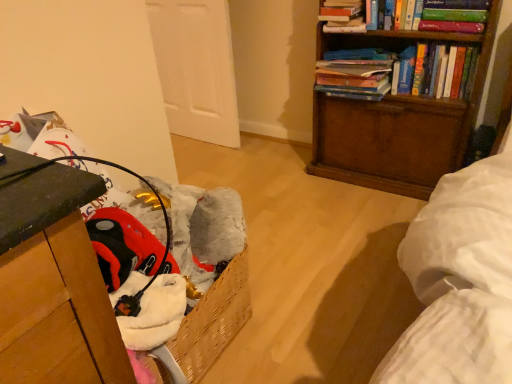
Question: Considering the relative sizes of wooden bookcase at upper right and hardcover books at upper right, which ranks as the second book in left-to-right order, in the image provided, is wooden bookcase at upper right taller than hardcover books at upper right, which ranks as the second book in left-to-right order,?

Choices:
 (A) yes
 (B) no

Answer: (A)

Question: Can you confirm if wooden bookcase at upper right is smaller than hardcover books at upper right, the 2th book from the right?

Choices:
 (A) yes
 (B) no

Answer: (B)

Question: Is hardcover books at upper right, which ranks as the second book in left-to-right order, located within wooden bookcase at upper right?

Choices:
 (A) no
 (B) yes

Answer: (B)

Question: Is the depth of wooden bookcase at upper right greater than that of hardcover books at upper right, which ranks as the second book in left-to-right order?

Choices:
 (A) no
 (B) yes

Answer: (A)

Question: Does wooden bookcase at upper right appear on the left side of hardcover books at upper right, the 2th book from the right?

Choices:
 (A) no
 (B) yes

Answer: (A)

Question: In terms of height, does hardcover books at upper right, the third book from the left, look taller or shorter compared to hardcover book at upper right, the 3th book from the right?

Choices:
 (A) tall
 (B) short

Answer: (A)

Question: Looking at the image, does hardcover books at upper right, the third book from the left, seem bigger or smaller compared to hardcover book at upper right, which is the 1th book from left to right?

Choices:
 (A) small
 (B) big

Answer: (B)

Question: Is point (461, 59) positioned closer to the camera than point (352, 16)?

Choices:
 (A) farther
 (B) closer

Answer: (B)

Question: From a real-world perspective, is hardcover books at upper right, the 1th book when ordered from right to left, above or below hardcover book at upper right, the 3th book from the right?

Choices:
 (A) below
 (B) above

Answer: (A)

Question: Looking at their shapes, would you say hardcover books at upper right, the third book from the left, is wider or thinner than wooden bookcase at upper right?

Choices:
 (A) thin
 (B) wide

Answer: (A)

Question: Is hardcover books at upper right, the third book from the left, bigger or smaller than wooden bookcase at upper right?

Choices:
 (A) small
 (B) big

Answer: (A)

Question: Considering the relative positions of hardcover books at upper right, the 1th book when ordered from right to left, and wooden bookcase at upper right in the image provided, is hardcover books at upper right, the 1th book when ordered from right to left, to the left or to the right of wooden bookcase at upper right?

Choices:
 (A) left
 (B) right

Answer: (B)

Question: Considering the positions of point (373, 92) and point (320, 147), is point (373, 92) closer or farther from the camera than point (320, 147)?

Choices:
 (A) farther
 (B) closer

Answer: (B)

Question: Is point (475, 36) closer or farther from the camera than point (339, 56)?

Choices:
 (A) closer
 (B) farther

Answer: (A)

Question: Choose the correct answer: Is wooden bookcase at upper right inside hardcover books at upper right, which ranks as the second book in left-to-right order, or outside it?

Choices:
 (A) inside
 (B) outside

Answer: (B)